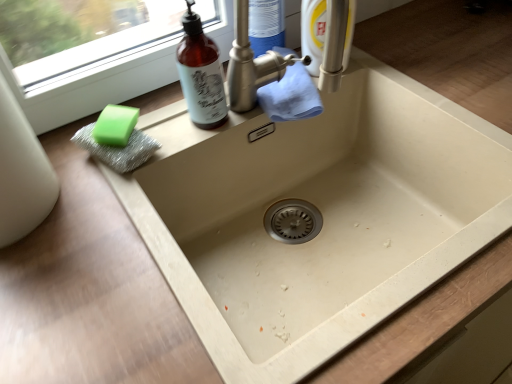
This screenshot has width=512, height=384. In order to click on green sponge at left in this screenshot , I will do `click(115, 125)`.

What do you see at coordinates (115, 125) in the screenshot? I see `green sponge at left` at bounding box center [115, 125].

Measure the distance between point (198, 83) and camera.

Point (198, 83) is 66.70 centimeters away from camera.

At what (x,y) coordinates should I click in order to perform the action: click on brown glass bottle at upper left. Please return your answer as a coordinate pair (x, y). Looking at the image, I should click on (201, 74).

This screenshot has width=512, height=384. What do you see at coordinates (201, 74) in the screenshot? I see `brown glass bottle at upper left` at bounding box center [201, 74].

In order to click on green sponge at left in this screenshot , I will do `click(115, 125)`.

Which object is positioned more to the right, green sponge at left or brown glass bottle at upper left?

brown glass bottle at upper left is more to the right.

Considering the positions of objects green sponge at left and brown glass bottle at upper left in the image provided, who is in front, green sponge at left or brown glass bottle at upper left?

Positioned in front is brown glass bottle at upper left.

Considering the points (128, 109) and (209, 50), which point is behind, point (128, 109) or point (209, 50)?

The point (128, 109) is more distant.

From the image's perspective, is green sponge at left positioned above or below brown glass bottle at upper left?

Based on their image positions, green sponge at left is located beneath brown glass bottle at upper left.

From a real-world perspective, is green sponge at left positioned above or below brown glass bottle at upper left?

In terms of real-world spatial position, green sponge at left is below brown glass bottle at upper left.

Which object is thinner, green sponge at left or brown glass bottle at upper left?

With smaller width is brown glass bottle at upper left.

Is green sponge at left taller than brown glass bottle at upper left?

In fact, green sponge at left may be shorter than brown glass bottle at upper left.

Considering the relative sizes of green sponge at left and brown glass bottle at upper left in the image provided, is green sponge at left bigger than brown glass bottle at upper left?

No.

Do you think green sponge at left is within brown glass bottle at upper left, or outside of it?

The correct answer is: outside.

Is green sponge at left next to brown glass bottle at upper left and touching it?

green sponge at left and brown glass bottle at upper left are not in contact.

Is green sponge at left positioned with its back to brown glass bottle at upper left?

No, green sponge at left's orientation is not away from brown glass bottle at upper left.

Identify the location of soap below the brown glass bottle at upper left (from the image's perspective). This screenshot has width=512, height=384. (115, 125).

In the image, is brown glass bottle at upper left on the left side or the right side of green sponge at left?

brown glass bottle at upper left is positioned on green sponge at left's right side.

Who is more distant, brown glass bottle at upper left or green sponge at left?

Positioned behind is green sponge at left.

Is point (183, 53) closer or farther from the camera than point (117, 136)?

Point (183, 53).

From the image's perspective, is brown glass bottle at upper left on green sponge at left?

Yes.

From a real-world perspective, is brown glass bottle at upper left above or below green sponge at left?

Clearly, from a real-world perspective, brown glass bottle at upper left is above green sponge at left.

In the scene shown: Looking at their sizes, would you say brown glass bottle at upper left is wider or thinner than green sponge at left?

Considering their sizes, brown glass bottle at upper left looks slimmer than green sponge at left.

Considering the relative sizes of brown glass bottle at upper left and green sponge at left in the image provided, is brown glass bottle at upper left taller than green sponge at left?

Yes, brown glass bottle at upper left is taller than green sponge at left.

Considering the sizes of objects brown glass bottle at upper left and green sponge at left in the image provided, who is bigger, brown glass bottle at upper left or green sponge at left?

With larger size is brown glass bottle at upper left.

Is brown glass bottle at upper left surrounding green sponge at left?

No, brown glass bottle at upper left does not contain green sponge at left.

Is the surface of brown glass bottle at upper left in direct contact with green sponge at left?

No.

Is brown glass bottle at upper left positioned with its back to green sponge at left?

That's not correct — brown glass bottle at upper left is not looking away from green sponge at left.

Can you tell me how much brown glass bottle at upper left and green sponge at left differ in facing direction?

40.6 degrees separate the facing orientations of brown glass bottle at upper left and green sponge at left.

At what (x,y) coordinates should I click in order to perform the action: click on bottle above the green sponge at left (from the image's perspective). Please return your answer as a coordinate pair (x, y). The height and width of the screenshot is (384, 512). Looking at the image, I should click on (201, 74).

You are a GUI agent. You are given a task and a screenshot of the screen. Output one action in this format:
    pyautogui.click(x=<x>, y=<y>)
    Task: Click on the soap lying behind the brown glass bottle at upper left
    This screenshot has width=512, height=384.
    Given the screenshot: What is the action you would take?
    pyautogui.click(x=115, y=125)

You are a GUI agent. You are given a task and a screenshot of the screen. Output one action in this format:
    pyautogui.click(x=<x>, y=<y>)
    Task: Click on the soap below the brown glass bottle at upper left (from a real-world perspective)
    The width and height of the screenshot is (512, 384).
    Given the screenshot: What is the action you would take?
    pyautogui.click(x=115, y=125)